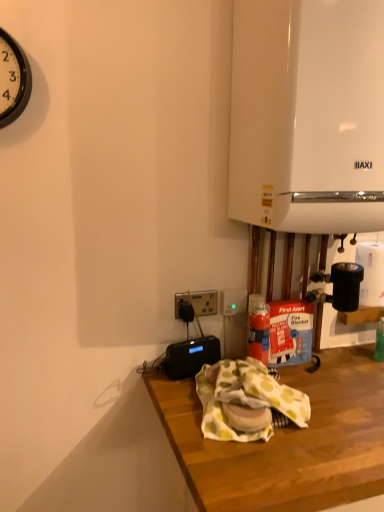
You are a GUI agent. You are given a task and a screenshot of the screen. Output one action in this format:
    pyautogui.click(x=<x>, y=<y>)
    Task: Click on the vacant region in front of black plastic radio at lower center, the 1th appliance from the bottom
    
    Given the screenshot: What is the action you would take?
    pyautogui.click(x=183, y=397)